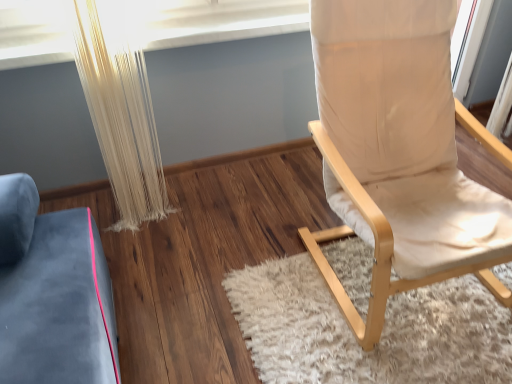
You are a GUI agent. You are given a task and a screenshot of the screen. Output one action in this format:
    pyautogui.click(x=<x>, y=<y>)
    Task: Click on the empty space that is ontop of white shaggy rug at center (from a real-world perspective)
    This screenshot has width=512, height=384.
    Given the screenshot: What is the action you would take?
    pyautogui.click(x=364, y=317)